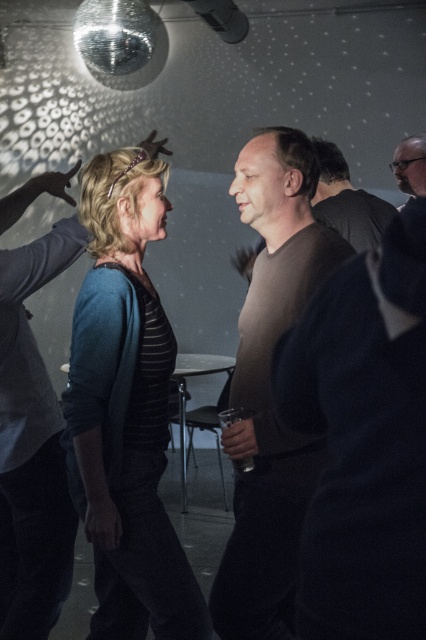
Does brown matte shirt at center have a greater height compared to bearded man at upper right?

Yes, brown matte shirt at center is taller than bearded man at upper right.

Is the position of brown matte shirt at center less distant than that of bearded man at upper right?

Yes, it is.

Is point (256, 477) closer to viewer compared to point (408, 168)?

Yes.

Image resolution: width=426 pixels, height=640 pixels. What are the coordinates of `brown matte shirt at center` in the screenshot? It's located at (270, 387).

Can you confirm if blue knit sweater at left is positioned above bearded man at upper right?

Incorrect, blue knit sweater at left is not positioned above bearded man at upper right.

Does point (134, 460) lie in front of point (397, 156)?

That is True.

Identify the location of blue knit sweater at left. (126, 410).

Who is shorter, blue knit sweater at left or dark brown leather jacket at center?

Standing shorter between the two is dark brown leather jacket at center.

Who is more distant from viewer, (157, 580) or (357, 237)?

Positioned behind is point (357, 237).

The image size is (426, 640). Identify the location of blue knit sweater at left. (126, 410).